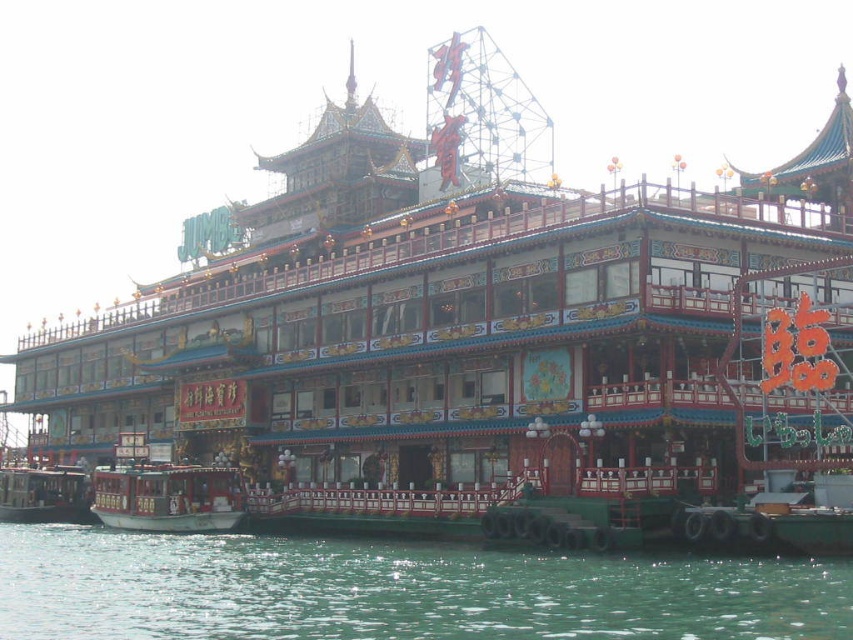
This screenshot has height=640, width=853. In order to click on green water at lower center in this screenshot , I will do 393,592.

Is green water at lower center to the left of black polished wood boat at lower left from the viewer's perspective?

In fact, green water at lower center is to the right of black polished wood boat at lower left.

You are a GUI agent. You are given a task and a screenshot of the screen. Output one action in this format:
    pyautogui.click(x=<x>, y=<y>)
    Task: Click on the green water at lower center
    Image resolution: width=853 pixels, height=640 pixels.
    Given the screenshot: What is the action you would take?
    pyautogui.click(x=393, y=592)